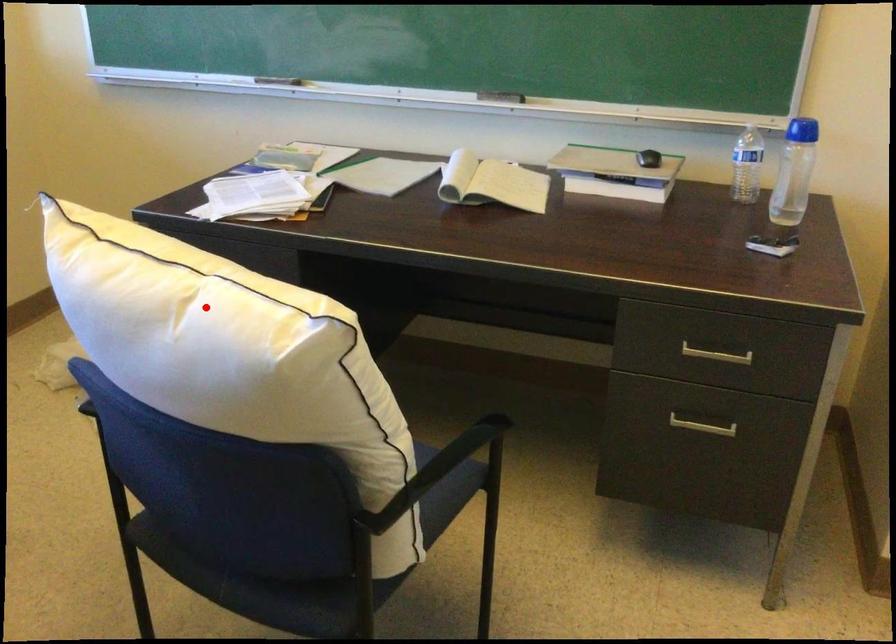
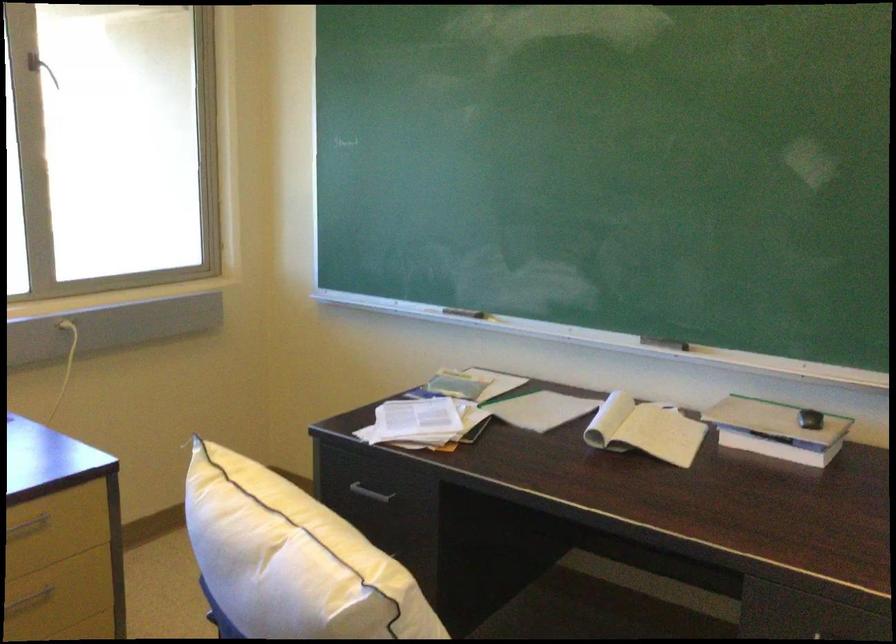
Where in the second image is the point corresponding to the highlighted location from the first image?

(291, 559)